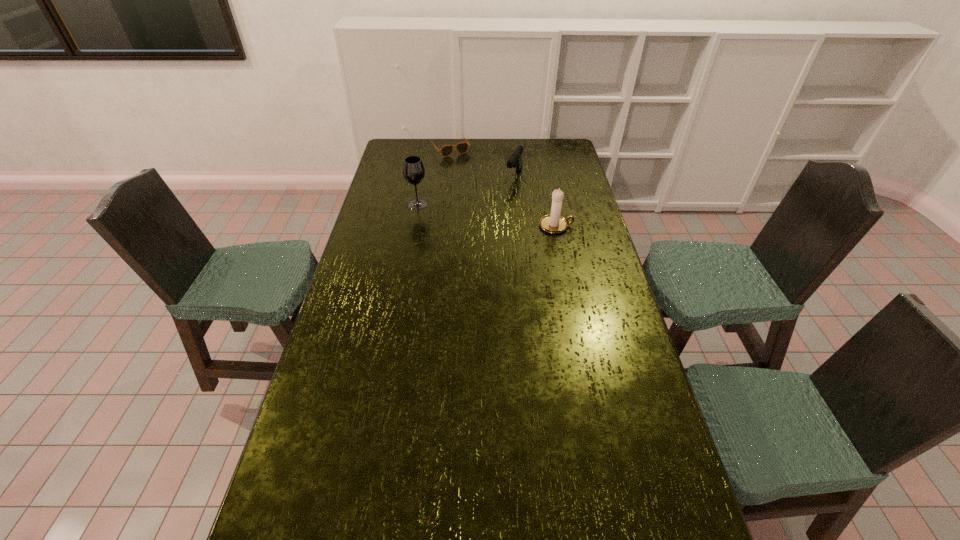
At what (x,y) coordinates should I click in order to perform the action: click on free space on the desktop that is between the wineglass and the third shortest object and is positioned on the front-facing side of the second farthest object. Please return your answer as a coordinate pair (x, y). This screenshot has height=540, width=960. Looking at the image, I should click on [x=487, y=215].

Locate an element on the screen. free spot on the desktop that is between the third farthest object and the second tallest object and is positioned on the front-facing side of the farthest object is located at coordinates [503, 218].